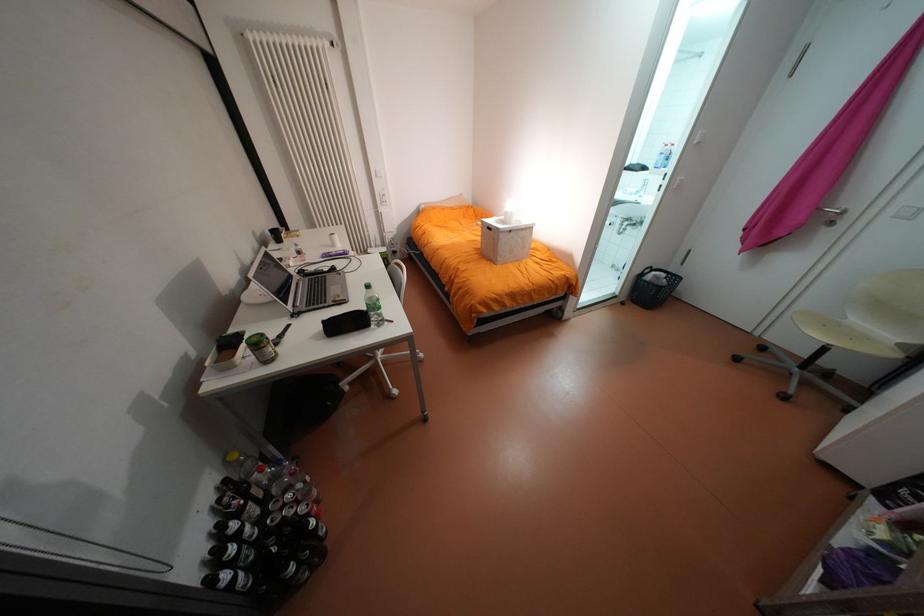
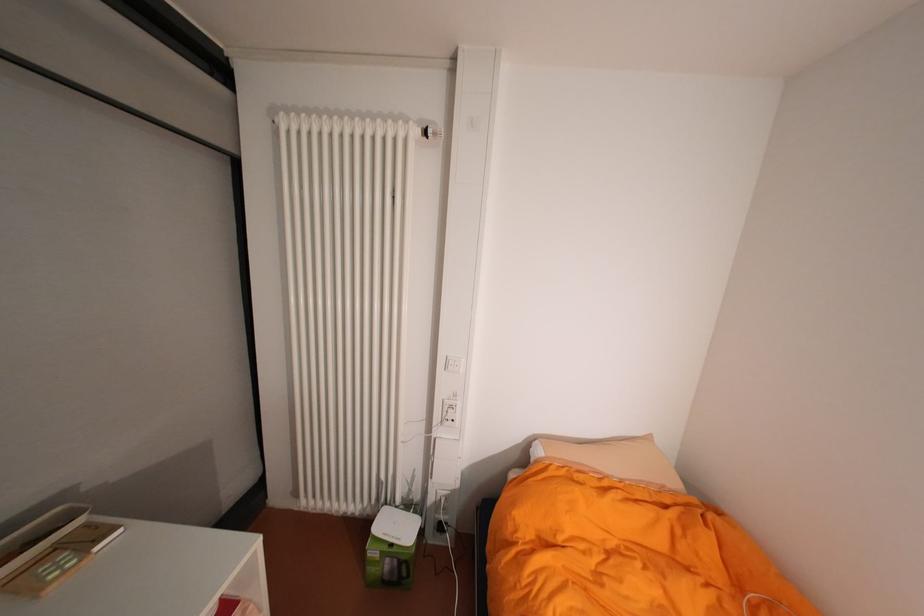
The point at (342, 44) is marked in the first image. Where is the corresponding point in the second image?

(434, 132)